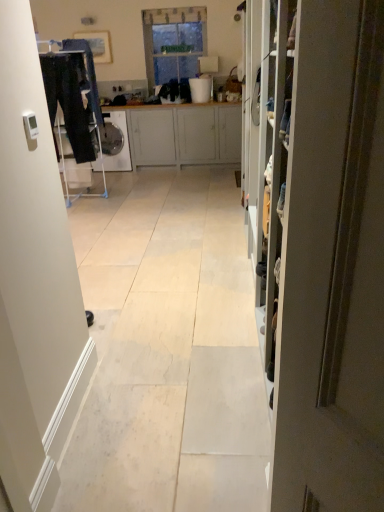
Describe the element at coordinates (72, 93) in the screenshot. I see `dark blue jeans at left` at that location.

At what (x,y) coordinates should I click in order to perform the action: click on dark blue jeans at left. Please return your answer as a coordinate pair (x, y). Image resolution: width=384 pixels, height=512 pixels. Looking at the image, I should click on (72, 93).

In order to face clear glass window at center, should I rotate leftwards or rightwards?

A 1.562 degree turn to the left will do.

This screenshot has width=384, height=512. What are the coordinates of `white plastic bucket at upper center` in the screenshot? It's located at (201, 89).

What do you see at coordinates (184, 135) in the screenshot? I see `light gray wood cabinet at center` at bounding box center [184, 135].

Identify the location of dark blue jeans at left. (72, 93).

From the image's perspective, is clear glass window at center located above white plastic bucket at upper center?

Yes.

Who is shorter, clear glass window at center or white plastic bucket at upper center?

white plastic bucket at upper center is shorter.

From a real-world perspective, is clear glass window at center above or below white plastic bucket at upper center?

In terms of real-world spatial position, clear glass window at center is above white plastic bucket at upper center.

Which of these two, white plastic bucket at upper center or dark blue jeans at left, is thinner?

With smaller width is dark blue jeans at left.

Is white plastic bucket at upper center in front of or behind dark blue jeans at left in the image?

Visually, white plastic bucket at upper center is located behind dark blue jeans at left.

Considering the relative sizes of white plastic bucket at upper center and dark blue jeans at left in the image provided, is white plastic bucket at upper center bigger than dark blue jeans at left?

No.

From a real-world perspective, is white plastic bucket at upper center below dark blue jeans at left?

Incorrect, from a real-world perspective, white plastic bucket at upper center is higher than dark blue jeans at left.

Is the depth of matte gray door at right less than that of white glossy dishwasher at center?

Yes, it is.

Can you tell me how much matte gray door at right and white glossy dishwasher at center differ in facing direction?

They differ by 58.2 degrees in their facing directions.

From a real-world perspective, between matte gray door at right and white glossy dishwasher at center, who is vertically higher?

In real-world perspective, matte gray door at right is above.

Is point (338, 199) farther from camera compared to point (127, 138)?

No, (338, 199) is in front of (127, 138).

Is clear glass window at center far away from matte gray door at right?

Yes.

Considering their positions, is clear glass window at center located in front of or behind matte gray door at right?

Visually, clear glass window at center is located behind matte gray door at right.

Looking at this image, is clear glass window at center bigger than matte gray door at right?

Yes, clear glass window at center is bigger than matte gray door at right.

From the picture: From a real-world perspective, relative to white glossy dishwasher at center, is white plastic bucket at upper center vertically above or below?

white plastic bucket at upper center is situated higher than white glossy dishwasher at center in the real world.

Does white plastic bucket at upper center have a larger size compared to white glossy dishwasher at center?

No, white plastic bucket at upper center is not bigger than white glossy dishwasher at center.

Is white plastic bucket at upper center at the right side of white glossy dishwasher at center?

Yes, white plastic bucket at upper center is to the right of white glossy dishwasher at center.

From the picture: Is light gray wood cabinet at center smaller than matte gray door at right?

No, light gray wood cabinet at center is not smaller than matte gray door at right.

Is point (235, 148) closer to camera compared to point (298, 308)?

No, (235, 148) is behind (298, 308).

From a real-world perspective, which is physically below, light gray wood cabinet at center or matte gray door at right?

In real-world perspective, light gray wood cabinet at center is lower.

Does light gray wood cabinet at center appear on the left side of matte gray door at right?

Indeed, light gray wood cabinet at center is positioned on the left side of matte gray door at right.

Is white glossy dishwasher at center taller than matte gray door at right?

No.

Based on the photo, in terms of width, does white glossy dishwasher at center look wider or thinner when compared to matte gray door at right?

Considering their sizes, white glossy dishwasher at center looks broader than matte gray door at right.

Considering the points (93, 168) and (374, 292), which point is behind, point (93, 168) or point (374, 292)?

The point (93, 168) is farther from the camera.

Is white glossy dishwasher at center to the left of matte gray door at right from the viewer's perspective?

Correct, you'll find white glossy dishwasher at center to the left of matte gray door at right.

The image size is (384, 512). I want to click on appliance to the right of clear glass window at center, so click(x=201, y=89).

Where is `laundry in front of the white plastic bucket at upper center`? laundry in front of the white plastic bucket at upper center is located at coordinates (72, 93).

Considering their positions, is dark blue jeans at left positioned further to white glossy dishwasher at center than matte gray door at right?

matte gray door at right is positioned further to the anchor white glossy dishwasher at center.

Estimate the real-world distances between objects in this image. Which object is further from dark blue jeans at left, white plastic bucket at upper center or matte gray door at right?

matte gray door at right is positioned further to the anchor dark blue jeans at left.

Based on their spatial positions, is dark blue jeans at left or white plastic bucket at upper center further from white glossy dishwasher at center?

white plastic bucket at upper center.

Considering their positions, is clear glass window at center positioned closer to white plastic bucket at upper center than matte gray door at right?

clear glass window at center is closer to white plastic bucket at upper center.

From the image, which object appears to be nearer to white plastic bucket at upper center, light gray wood cabinet at center or dark blue jeans at left?

A: light gray wood cabinet at center is closer to white plastic bucket at upper center.

Looking at the image, which one is located closer to dark blue jeans at left, matte gray door at right or white plastic bucket at upper center?

white plastic bucket at upper center is closer to dark blue jeans at left.

Estimate the real-world distances between objects in this image. Which object is closer to light gray wood cabinet at center, matte gray door at right or clear glass window at center?

Based on the image, clear glass window at center appears to be nearer to light gray wood cabinet at center.

Which object lies further to the anchor point white glossy dishwasher at center, matte gray door at right or clear glass window at center?

matte gray door at right lies further to white glossy dishwasher at center than the other object.

Locate an element on the screen. The height and width of the screenshot is (512, 384). appliance between matte gray door at right and clear glass window at center from front to back is located at coordinates (201, 89).

The image size is (384, 512). I want to click on laundry positioned between matte gray door at right and white glossy dishwasher at center from near to far, so click(72, 93).

I want to click on dish washer positioned between matte gray door at right and clear glass window at center from near to far, so click(x=123, y=145).

This screenshot has width=384, height=512. In order to click on cabinetry positioned between matte gray door at right and clear glass window at center from near to far in this screenshot , I will do `click(184, 135)`.